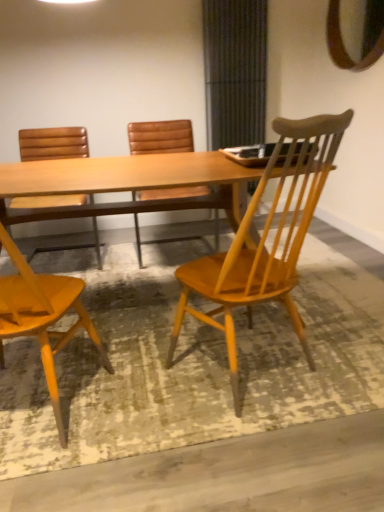
What do you see at coordinates (138, 179) in the screenshot? The height and width of the screenshot is (512, 384). I see `light brown wood table at center` at bounding box center [138, 179].

What is the approximate width of brown leather chair at center, which is the 3th chair in left-to-right order?

brown leather chair at center, which is the 3th chair in left-to-right order, is 25.65 inches wide.

The height and width of the screenshot is (512, 384). What do you see at coordinates (42, 316) in the screenshot? I see `matte wood chair at left, the third chair viewed from the right` at bounding box center [42, 316].

Consider the image. Measure the distance between matte brown leather chair at left, the 1th chair from the left, and camera.

The distance of matte brown leather chair at left, the 1th chair from the left, from camera is 9.14 feet.

This screenshot has height=512, width=384. What do you see at coordinates (53, 143) in the screenshot?
I see `matte brown leather chair at left, which is counted as the fourth chair, starting from the right` at bounding box center [53, 143].

The image size is (384, 512). What do you see at coordinates (265, 240) in the screenshot? I see `wooden chair at center, positioned as the 1th chair in right-to-left order` at bounding box center [265, 240].

What do you see at coordinates (355, 33) in the screenshot? I see `wooden mirror at upper right` at bounding box center [355, 33].

The image size is (384, 512). Identify the location of wooden mirror at upper right. (355, 33).

This screenshot has height=512, width=384. I want to click on light brown wood table at center, so click(x=138, y=179).

Is light brown wood table at center placed right next to brown leather chair at center, which is the 3th chair in left-to-right order?

→ They are not placed beside each other.

From a real-world perspective, is light brown wood table at center positioned under brown leather chair at center, the second chair in the right-to-left sequence, based on gravity?

Yes.

Between point (238, 217) and point (158, 139), which one is positioned in front?

The point (238, 217) is more forward.

Which is more to the right, light brown wood table at center or brown leather chair at center, which is the 3th chair in left-to-right order?

brown leather chair at center, which is the 3th chair in left-to-right order, is more to the right.

Does point (330, 164) appear closer or farther from the camera than point (29, 132)?

Point (330, 164).

Is wooden chair at center, arranged as the 4th chair when viewed from the left, not close to matte brown leather chair at left, which is counted as the fourth chair, starting from the right?

Yes.

Considering the relative positions of wooden chair at center, positioned as the 1th chair in right-to-left order, and matte brown leather chair at left, the 1th chair from the left, in the image provided, is wooden chair at center, positioned as the 1th chair in right-to-left order, behind matte brown leather chair at left, the 1th chair from the left,?

No, wooden chair at center, positioned as the 1th chair in right-to-left order, is closer to the camera.

From the image's perspective, is wooden chair at center, arranged as the 4th chair when viewed from the left, below matte brown leather chair at left, which is counted as the fourth chair, starting from the right?

Yes, from the image's perspective, wooden chair at center, arranged as the 4th chair when viewed from the left, is below matte brown leather chair at left, which is counted as the fourth chair, starting from the right.

Considering the sizes of objects matte brown leather chair at left, the 1th chair from the left, and matte wood chair at left, the third chair viewed from the right, in the image provided, who is smaller, matte brown leather chair at left, the 1th chair from the left, or matte wood chair at left, the third chair viewed from the right,?

With smaller size is matte wood chair at left, the third chair viewed from the right.

Is matte brown leather chair at left, the 1th chair from the left, touching matte wood chair at left, the third chair viewed from the right?

They are not placed beside each other.

Is the position of matte brown leather chair at left, the 1th chair from the left, less distant than that of matte wood chair at left, acting as the second chair starting from the left?

No, matte brown leather chair at left, the 1th chair from the left, is further to the viewer.

Could you measure the distance between matte brown leather chair at left, which is counted as the fourth chair, starting from the right, and matte wood chair at left, the third chair viewed from the right?

matte brown leather chair at left, which is counted as the fourth chair, starting from the right, is 1.54 meters from matte wood chair at left, the third chair viewed from the right.

Is wooden mirror at upper right oriented away from brown leather chair at center, the second chair in the right-to-left sequence?

That's not correct — wooden mirror at upper right is not looking away from brown leather chair at center, the second chair in the right-to-left sequence.

Is wooden mirror at upper right not inside brown leather chair at center, which is the 3th chair in left-to-right order?

Absolutely, wooden mirror at upper right is external to brown leather chair at center, which is the 3th chair in left-to-right order.

From the image's perspective, is wooden mirror at upper right below brown leather chair at center, the second chair in the right-to-left sequence?

Actually, wooden mirror at upper right appears above brown leather chair at center, the second chair in the right-to-left sequence, in the image.

How much distance is there between light brown wood table at center and wooden chair at center, positioned as the 1th chair in right-to-left order?

8.36 inches.

From a real-world perspective, which is physically above, light brown wood table at center or wooden chair at center, positioned as the 1th chair in right-to-left order?

In real-world perspective, wooden chair at center, positioned as the 1th chair in right-to-left order, is above.

Does light brown wood table at center turn towards wooden chair at center, arranged as the 4th chair when viewed from the left?

Yes, light brown wood table at center is oriented towards wooden chair at center, arranged as the 4th chair when viewed from the left.

Does point (61, 166) lie in front of point (320, 138)?

No, it is not.

Is matte wood chair at left, the third chair viewed from the right, completely or partially outside of wooden chair at center, positioned as the 1th chair in right-to-left order?

That's correct, matte wood chair at left, the third chair viewed from the right, is outside of wooden chair at center, positioned as the 1th chair in right-to-left order.

In terms of height, does matte wood chair at left, the third chair viewed from the right, look taller or shorter compared to wooden chair at center, positioned as the 1th chair in right-to-left order?

Considering their sizes, matte wood chair at left, the third chair viewed from the right, has less height than wooden chair at center, positioned as the 1th chair in right-to-left order.

How distant is matte wood chair at left, the third chair viewed from the right, from wooden chair at center, arranged as the 4th chair when viewed from the left?

matte wood chair at left, the third chair viewed from the right, is 23.16 inches away from wooden chair at center, arranged as the 4th chair when viewed from the left.

From the image's perspective, is matte wood chair at left, acting as the second chair starting from the left, located above or below wooden chair at center, positioned as the 1th chair in right-to-left order?

Clearly, from the image's perspective, matte wood chair at left, acting as the second chair starting from the left, is below wooden chair at center, positioned as the 1th chair in right-to-left order.

From a real-world perspective, relative to wooden mirror at upper right, is matte brown leather chair at left, the 1th chair from the left, vertically above or below?

In terms of real-world spatial position, matte brown leather chair at left, the 1th chair from the left, is below wooden mirror at upper right.

In terms of height, does matte brown leather chair at left, the 1th chair from the left, look taller or shorter compared to wooden mirror at upper right?

Clearly, matte brown leather chair at left, the 1th chair from the left, is taller compared to wooden mirror at upper right.

Relative to wooden mirror at upper right, is matte brown leather chair at left, which is counted as the fourth chair, starting from the right, in front or behind?

In the image, matte brown leather chair at left, which is counted as the fourth chair, starting from the right, appears behind wooden mirror at upper right.

Which is closer to the camera, (75, 156) or (381, 47)?

Point (75, 156).

Locate an element on the screen. kitchen & dining room table that appears in front of the brown leather chair at center, which is the 3th chair in left-to-right order is located at coordinates (138, 179).

From the image's perspective, count 1st chairs upward from the wooden chair at center, positioned as the 1th chair in right-to-left order, and point to it. Please provide its 2D coordinates.

[(53, 143)]

Estimate the real-world distances between objects in this image. Which object is closer to matte brown leather chair at left, the 1th chair from the left, brown leather chair at center, which is the 3th chair in left-to-right order, or light brown wood table at center?

Among the two, brown leather chair at center, which is the 3th chair in left-to-right order, is located nearer to matte brown leather chair at left, the 1th chair from the left.

From the picture: When comparing their distances from wooden mirror at upper right, does brown leather chair at center, the second chair in the right-to-left sequence, or matte wood chair at left, acting as the second chair starting from the left, seem closer?

brown leather chair at center, the second chair in the right-to-left sequence, lies closer to wooden mirror at upper right than the other object.

Looking at the image, which one is located further to wooden mirror at upper right, light brown wood table at center or matte wood chair at left, the third chair viewed from the right?

matte wood chair at left, the third chair viewed from the right.

Which object lies further to the anchor point brown leather chair at center, the second chair in the right-to-left sequence, wooden mirror at upper right or wooden chair at center, positioned as the 1th chair in right-to-left order?

wooden chair at center, positioned as the 1th chair in right-to-left order, lies further to brown leather chair at center, the second chair in the right-to-left sequence, than the other object.

Looking at the image, which one is located further to brown leather chair at center, the second chair in the right-to-left sequence, matte wood chair at left, the third chair viewed from the right, or matte brown leather chair at left, which is counted as the fourth chair, starting from the right?

matte wood chair at left, the third chair viewed from the right, is further to brown leather chair at center, the second chair in the right-to-left sequence.

When comparing their distances from brown leather chair at center, which is the 3th chair in left-to-right order, does matte wood chair at left, acting as the second chair starting from the left, or wooden mirror at upper right seem further?

The object further to brown leather chair at center, which is the 3th chair in left-to-right order, is matte wood chair at left, acting as the second chair starting from the left.

Considering their positions, is matte brown leather chair at left, the 1th chair from the left, positioned closer to wooden mirror at upper right than brown leather chair at center, the second chair in the right-to-left sequence?

brown leather chair at center, the second chair in the right-to-left sequence.

Which object lies nearer to the anchor point light brown wood table at center, wooden mirror at upper right or wooden chair at center, arranged as the 4th chair when viewed from the left?

The object closer to light brown wood table at center is wooden chair at center, arranged as the 4th chair when viewed from the left.

I want to click on kitchen & dining room table between wooden chair at center, arranged as the 4th chair when viewed from the left, and matte brown leather chair at left, which is counted as the fourth chair, starting from the right, along the z-axis, so click(138, 179).

Locate an element on the screen. This screenshot has height=512, width=384. kitchen & dining room table between matte wood chair at left, acting as the second chair starting from the left, and brown leather chair at center, which is the 3th chair in left-to-right order, in the front-back direction is located at coordinates (138, 179).

What are the coordinates of `kitchen & dining room table between matte wood chair at left, acting as the second chair starting from the left, and wooden mirror at upper right from left to right` in the screenshot? It's located at (138, 179).

Image resolution: width=384 pixels, height=512 pixels. I want to click on chair between matte wood chair at left, the third chair viewed from the right, and matte brown leather chair at left, the 1th chair from the left, along the z-axis, so click(265, 240).